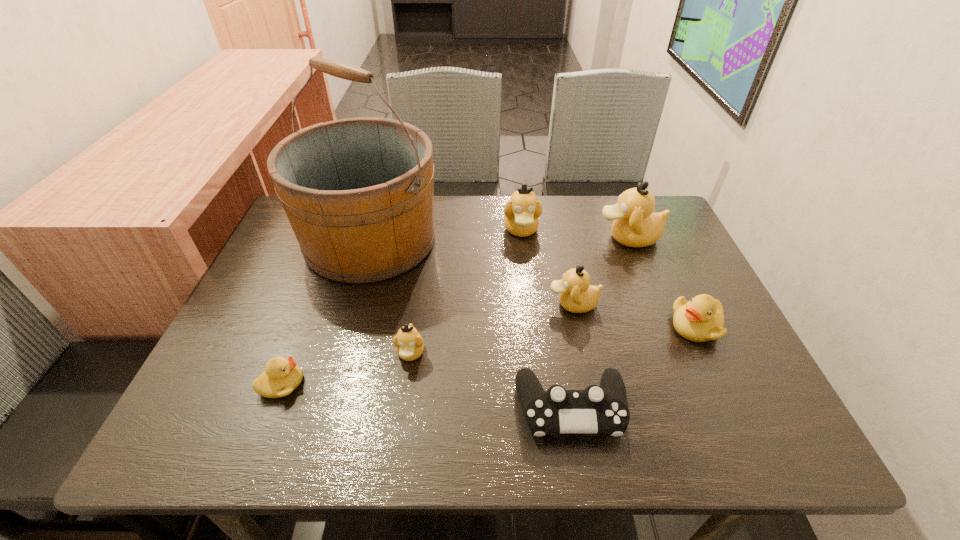
The image size is (960, 540). Find the location of `the leftmost tan duckling`. the leftmost tan duckling is located at coordinates (409, 344).

You are a GUI agent. You are given a task and a screenshot of the screen. Output one action in this format:
    pyautogui.click(x=<x>, y=<y>)
    Task: Click on the black control
    The height and width of the screenshot is (540, 960).
    Given the screenshot: What is the action you would take?
    pyautogui.click(x=598, y=409)

You are a GUI agent. You are given a task and a screenshot of the screen. Output one action in this format:
    pyautogui.click(x=<x>, y=<y>)
    Task: Click on the shortest duckling
    The height and width of the screenshot is (540, 960).
    Given the screenshot: What is the action you would take?
    (x=282, y=376)

Identify the location of the leftmost duckling. Image resolution: width=960 pixels, height=540 pixels. (282, 376).

Identify the location of free region located on the right of the bucket. [x=533, y=240].

Where is `free spot located on the face of the tallest duckling`? free spot located on the face of the tallest duckling is located at coordinates (550, 238).

Locate an element on the screen. This screenshot has height=540, width=960. vacant space located 0.050m on the face of the tallest duckling is located at coordinates (579, 238).

Locate an element on the screen. free space located 0.230m on the face of the tallest duckling is located at coordinates (515, 238).

At what (x,y) coordinates should I click in order to perform the action: click on vacant position located on the face of the sixth shortest object. Please return your answer as a coordinate pair (x, y). Looking at the image, I should click on (535, 345).

This screenshot has height=540, width=960. In order to click on free point located on the face of the third tallest duckling in this screenshot , I will do `click(468, 304)`.